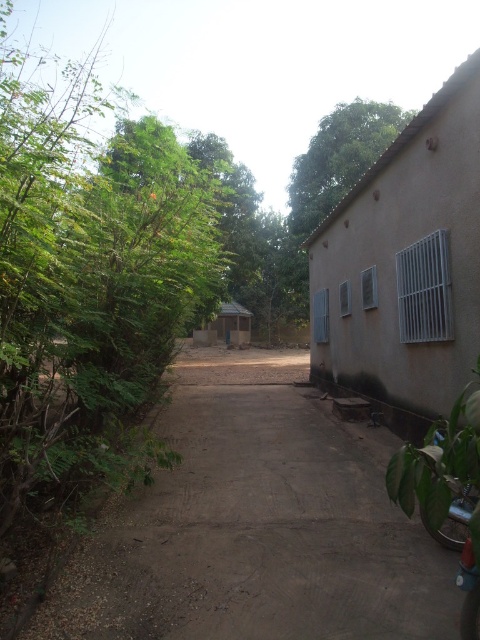
You are a hiker who wants to reach the building on the right side of the pathway. From your current position, which direction should you walk relative to the green leafy tree at upper center to stay on the dirt path at center?

You should walk to the left of the green leafy tree at upper center to stay on the dirt path at center, since the dirt path at center is positioned to the left of the green leafy tree at upper center.

You are a gardener planning to plant flowers along the dirt path at center and the green leafy bush at left. Which area requires more space to accommodate the new plants?

The green leafy bush at left requires more space because it is larger than the dirt path at center.

You are a hiker trying to navigate the dirt path at center. You notice a green leafy tree at upper center nearby. Which object is taller?

The green leafy tree at upper center is taller than the dirt path at center.